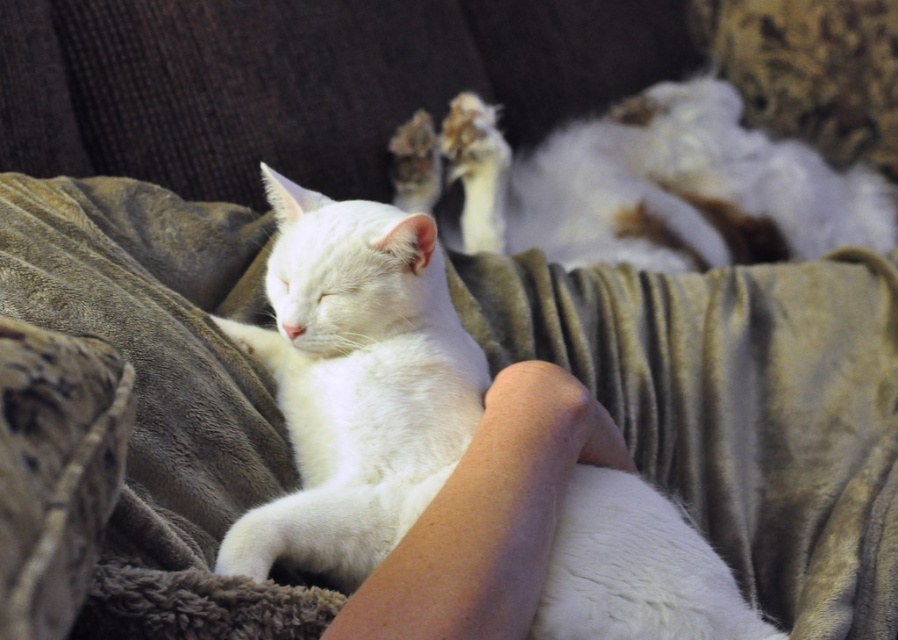
Question: Can you confirm if white fluffy cat at center is smaller than white fluffy cat at upper center?

Choices:
 (A) no
 (B) yes

Answer: (B)

Question: Does white fluffy cat at center appear on the right side of white fluffy cat at upper center?

Choices:
 (A) no
 (B) yes

Answer: (A)

Question: Which point appears farthest from the camera in this image?

Choices:
 (A) (348, 385)
 (B) (562, 205)

Answer: (B)

Question: Observing the image, what is the correct spatial positioning of white fluffy cat at center in reference to white fluffy cat at upper center?

Choices:
 (A) below
 (B) above

Answer: (A)

Question: Which of the following is the closest to the observer?

Choices:
 (A) white fluffy cat at center
 (B) white fluffy cat at upper center

Answer: (A)